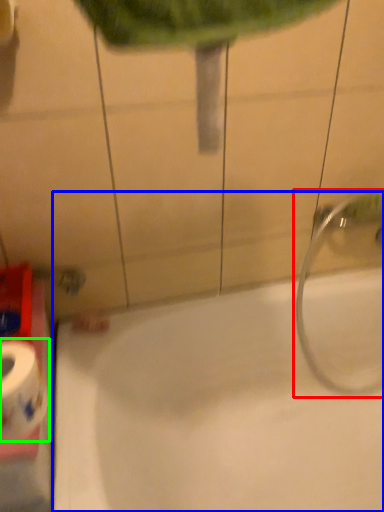
Question: Which object is positioned farthest from plumbing fixture (highlighted by a red box)? Select from bathtub (highlighted by a blue box) and toilet paper (highlighted by a green box).

Choices:
 (A) bathtub
 (B) toilet paper

Answer: (B)